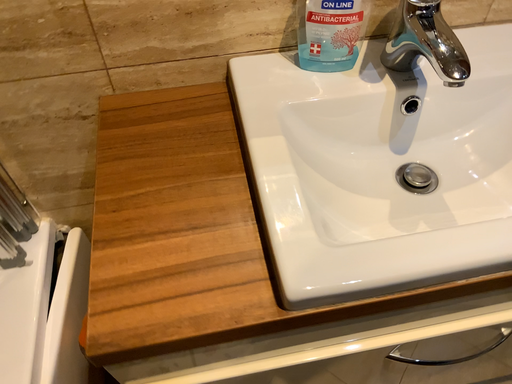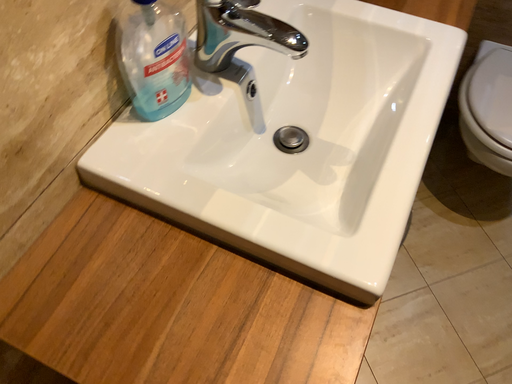
Question: How did the camera likely rotate when shooting the video?

Choices:
 (A) rotated left
 (B) rotated right

Answer: (B)